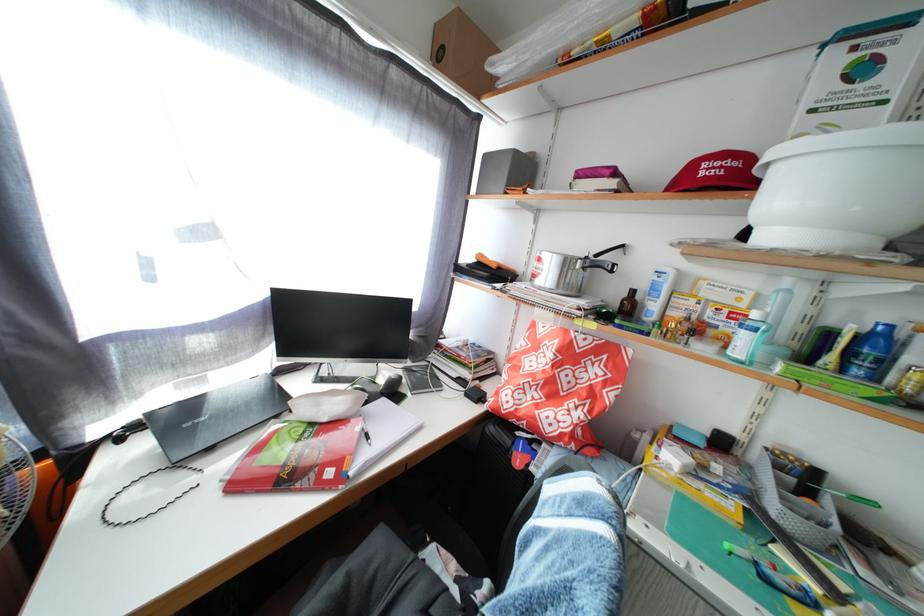
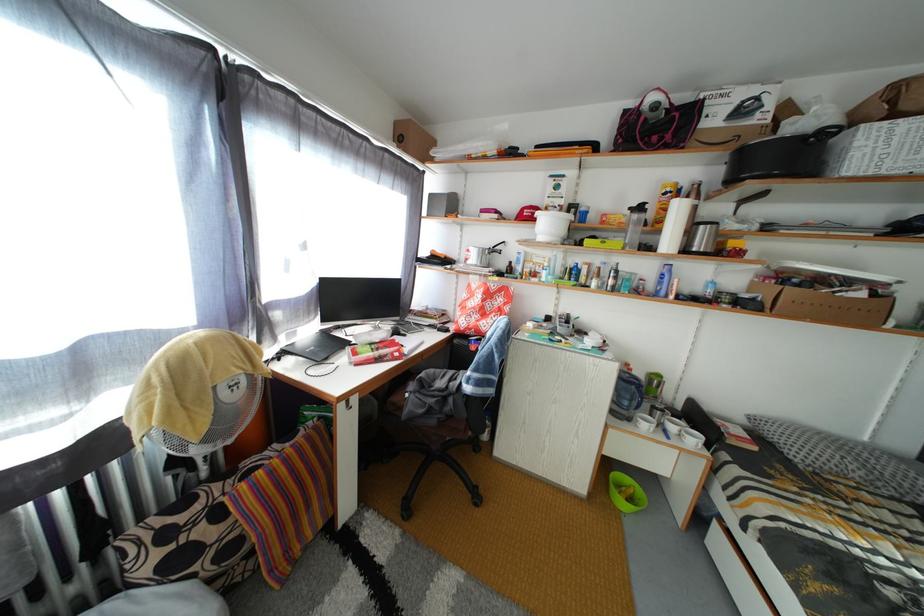
What movement of the cameraman would produce the second image?

The movement direction of the cameraman is left, backward.